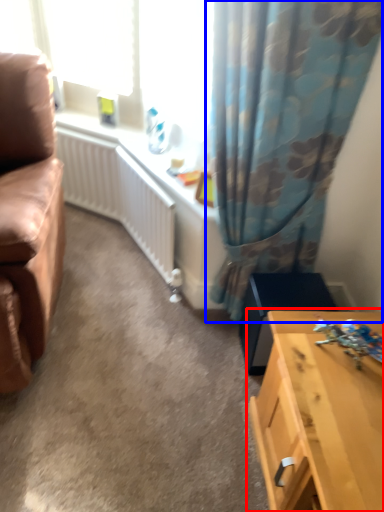
Question: Among these objects, which one is farthest to the camera, table (highlighted by a red box) or curtain (highlighted by a blue box)?

Choices:
 (A) table
 (B) curtain

Answer: (B)